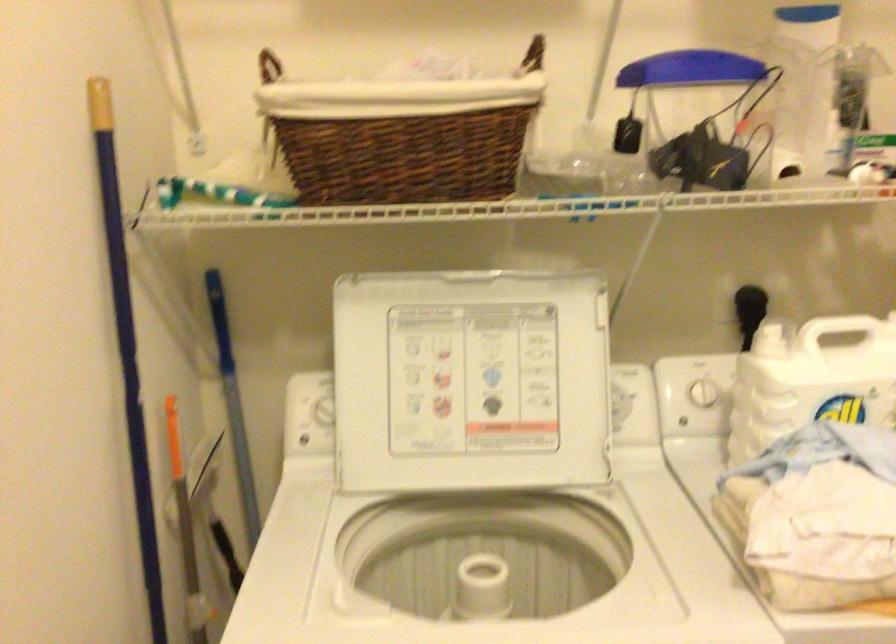
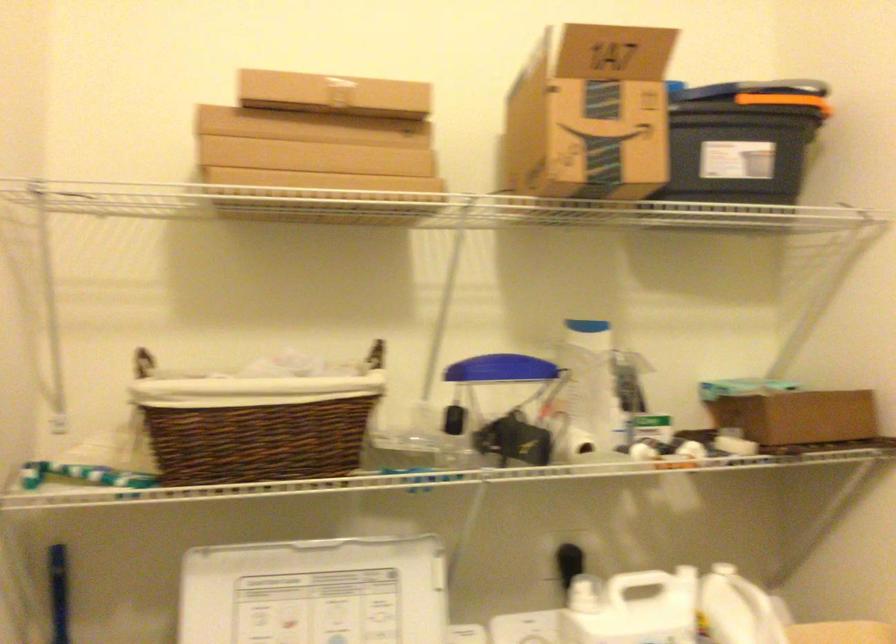
Question: Based on the continuous images, in which direction is the camera rotating? Reply with the corresponding letter.

Choices:
 (A) Left
 (B) Right
 (C) Up
 (D) Down

Answer: (C)